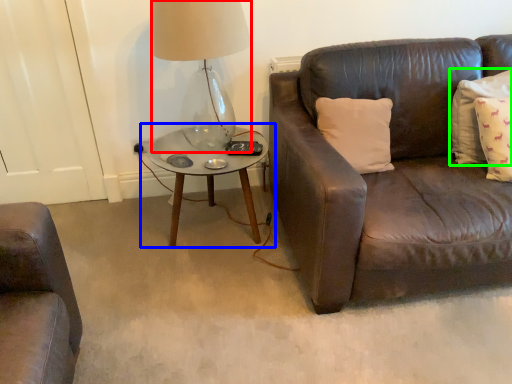
Question: Which object is the farthest from table lamp (highlighted by a red box)? Choose among these: coffee table (highlighted by a blue box) or pillow (highlighted by a green box).

Choices:
 (A) coffee table
 (B) pillow

Answer: (B)